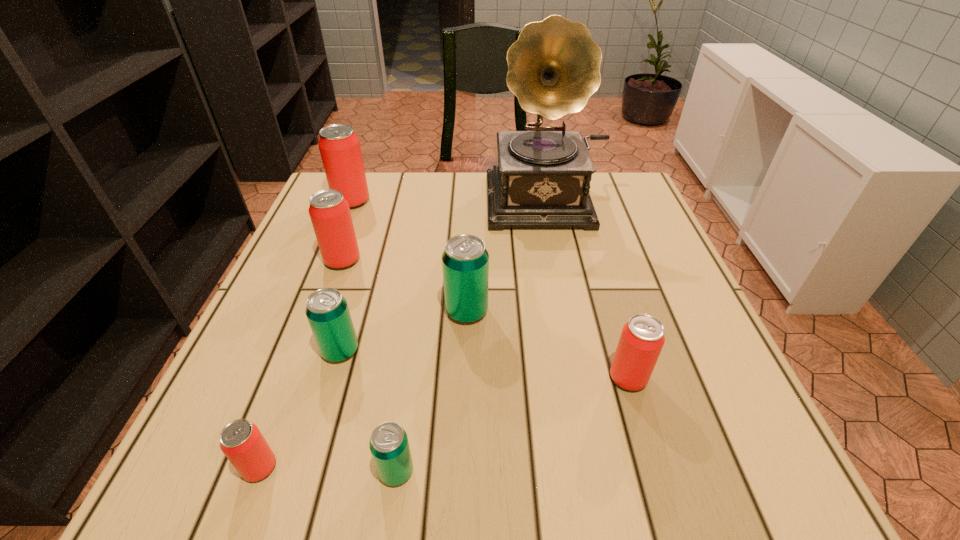
Locate an element on the screen. The height and width of the screenshot is (540, 960). vacant area that satisfies the following two spatial constraints: 1. on the back side of the nearest red beer can; 2. on the right side of the rightmost red beer can is located at coordinates (293, 377).

You are a GUI agent. You are given a task and a screenshot of the screen. Output one action in this format:
    pyautogui.click(x=<x>, y=<y>)
    Task: Click on the vacant space that satisfies the following two spatial constraints: 1. on the back side of the third nearest red beer can; 2. on the right side of the smallest red beer can
    
    Given the screenshot: What is the action you would take?
    pyautogui.click(x=337, y=260)

Where is `vacant area that satisfies the following two spatial constraints: 1. on the front side of the second smallest red beer can; 2. on the right side of the fifth nearest object`? The width and height of the screenshot is (960, 540). vacant area that satisfies the following two spatial constraints: 1. on the front side of the second smallest red beer can; 2. on the right side of the fifth nearest object is located at coordinates (465, 377).

Where is `vacant region that satisfies the following two spatial constraints: 1. on the back side of the sixth object from left to right; 2. on the left side of the nearest red beer can`? The height and width of the screenshot is (540, 960). vacant region that satisfies the following two spatial constraints: 1. on the back side of the sixth object from left to right; 2. on the left side of the nearest red beer can is located at coordinates (318, 311).

The image size is (960, 540). I want to click on vacant point that satisfies the following two spatial constraints: 1. on the front side of the second nearest teal beer can; 2. on the right side of the biggest red beer can, so click(x=292, y=350).

The image size is (960, 540). In order to click on free location that satisfies the following two spatial constraints: 1. on the back side of the smallest teal beer can; 2. on the left side of the third farthest beer can in this screenshot , I will do `click(419, 311)`.